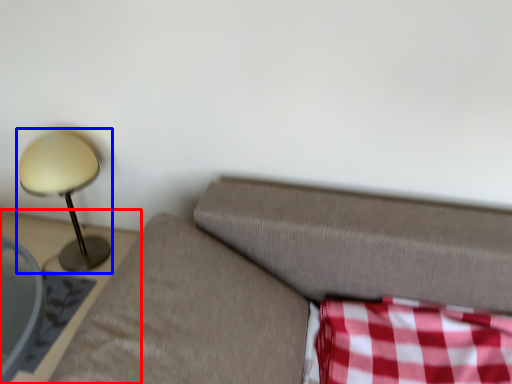
Question: Which point is closer to the camera, furniture (highlighted by a red box) or lamp (highlighted by a blue box)?

Choices:
 (A) furniture
 (B) lamp

Answer: (A)